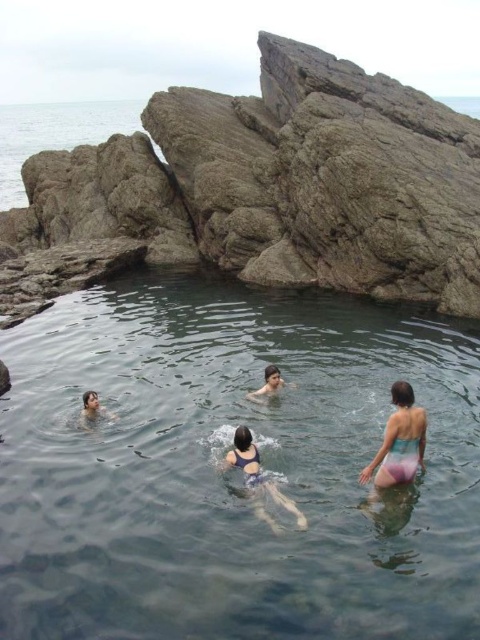
You are a photographer positioned on the beach, aiming to capture a clear shot of the transparent plastic pool at center and the solid purple swimsuit at center. Which object will appear larger in your photo?

The transparent plastic pool at center will appear larger in the photo because it is closer to the viewer than the solid purple swimsuit at center.